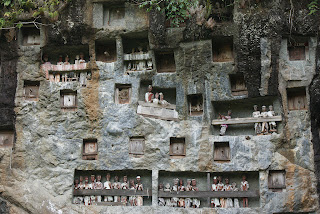
What are the coordinates of `windows` in the screenshot? It's located at (94, 148), (132, 142), (173, 145), (218, 151), (272, 180), (129, 97), (69, 100), (33, 88), (34, 40), (121, 12).